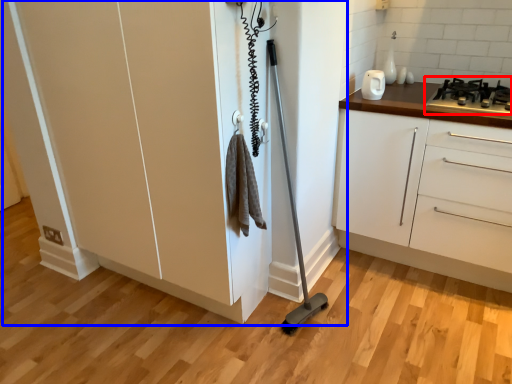
Question: Among these objects, which one is nearest to the camera, gas stove (highlighted by a red box) or cupboard (highlighted by a blue box)?

Choices:
 (A) gas stove
 (B) cupboard

Answer: (B)